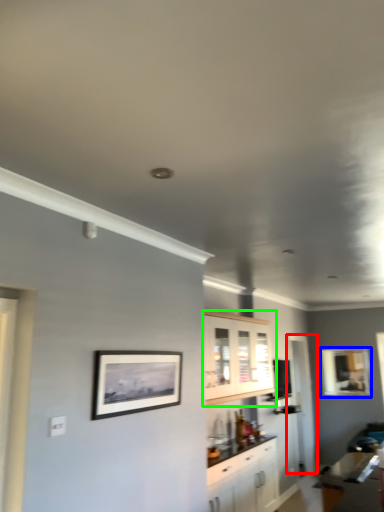
Question: Considering the real-world distances, which object is farthest from glass door (highlighted by a red box)? picture frame (highlighted by a blue box) or cabinetry (highlighted by a green box)?

Choices:
 (A) picture frame
 (B) cabinetry

Answer: (B)